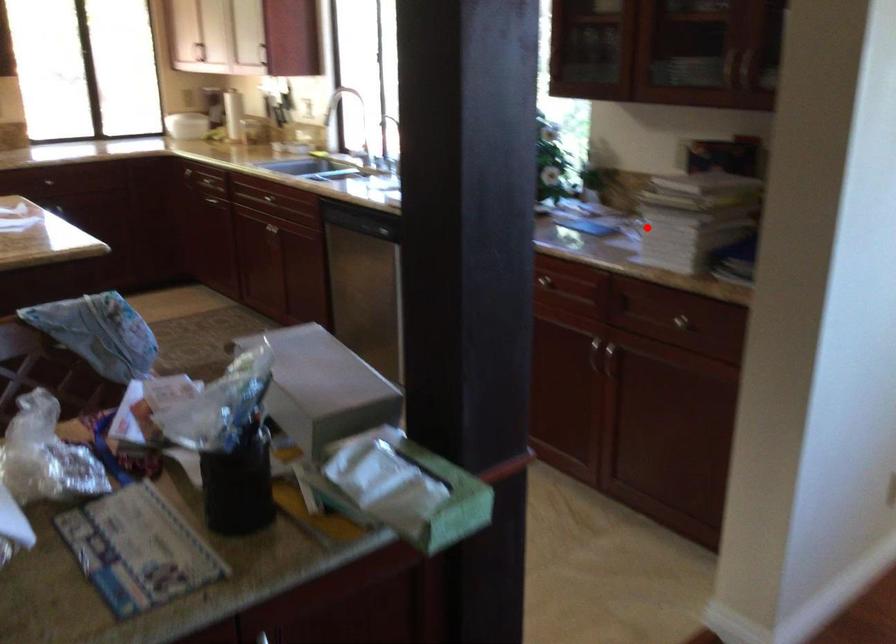
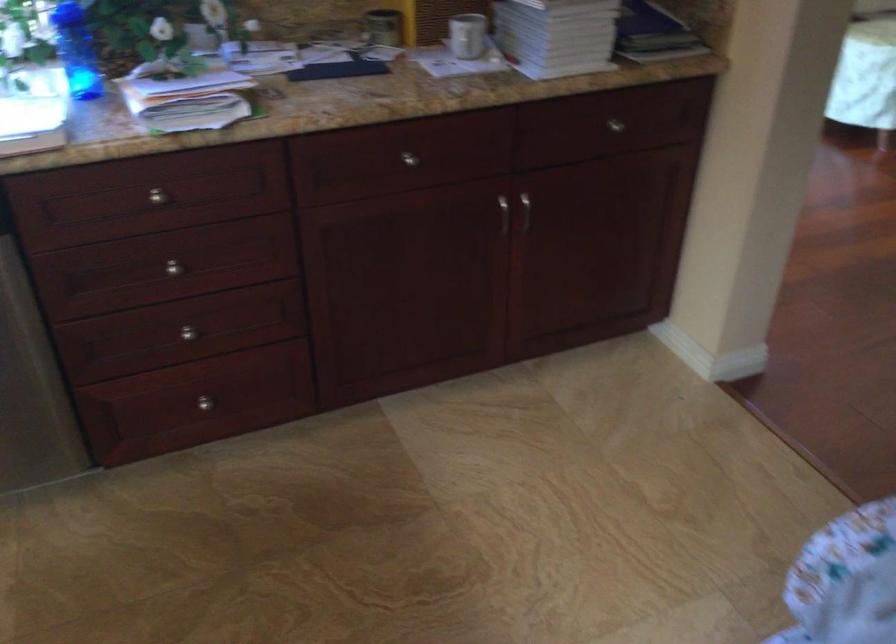
Question: I am providing you with two images of the same scene from different viewpoints. Image1 has a red point marked. In image2, the corresponding 3D location appears at what relative position? Reply with the corresponding letter.

Choices:
 (A) Closer
 (B) Farther

Answer: (A)